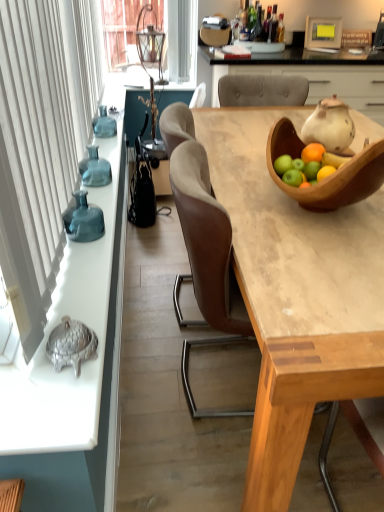
Where is `free space in front of wooden bowl at upper right`? The width and height of the screenshot is (384, 512). free space in front of wooden bowl at upper right is located at coordinates (319, 256).